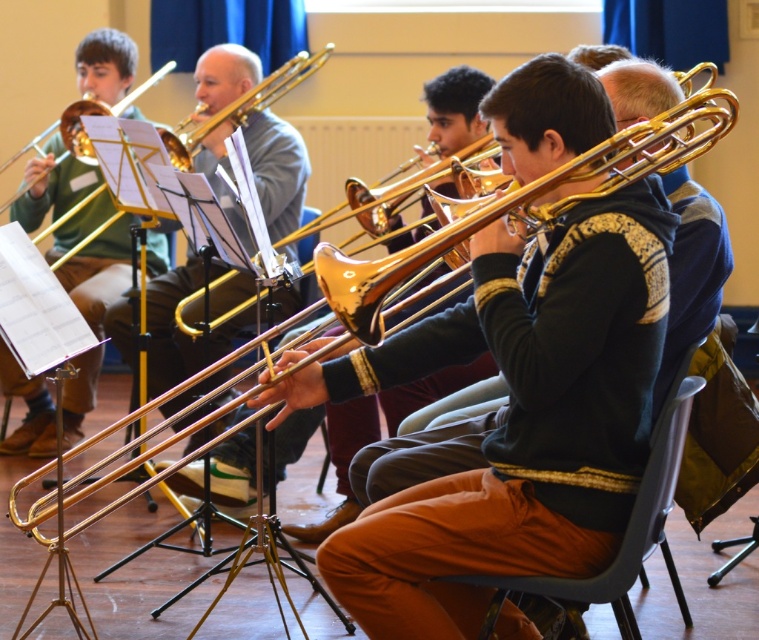
You are a photographer positioned in front of the group. You need to capture a photo that includes both the gold brass trombone at center and the gold brass trumpet at upper left. Which instrument should you adjust your camera to focus on first if you want to ensure both are in frame without moving the camera?

The gold brass trumpet at upper left should be focused on first because the gold brass trombone at center is to the left of it, so adjusting focus starting from the trumpet ensures the trombone remains within the frame.

You are a photographer positioned in front of the group. You want to capture a photo that includes both the gold brass trombone at center and the gold brass trumpet at upper left. Which instrument should you focus on first to ensure both are in frame?

The gold brass trombone at center is below the gold brass trumpet at upper left, so you should focus on the gold brass trumpet at upper left first to ensure both are in frame.